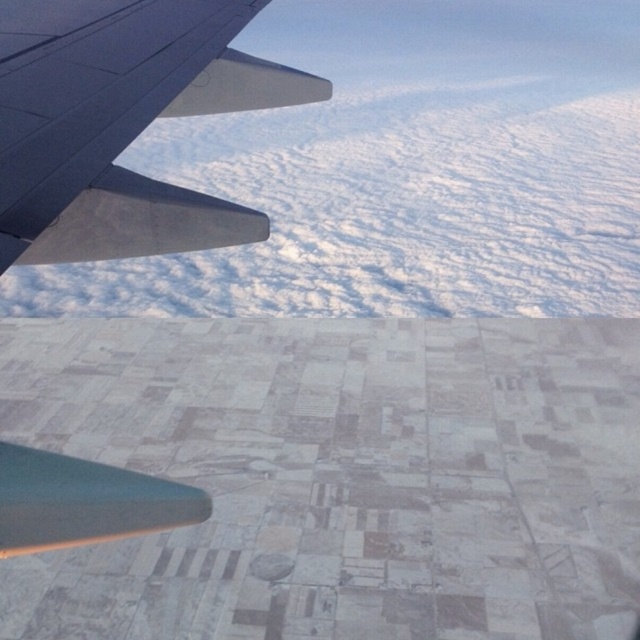
Question: Is white fluffy cloud at upper center closer to the viewer compared to metallic gray wing at upper left?

Choices:
 (A) yes
 (B) no

Answer: (B)

Question: Which point is closer to the camera?

Choices:
 (A) (177, 218)
 (B) (244, 273)

Answer: (A)

Question: Can you confirm if white fluffy cloud at upper center is smaller than metallic gray wing at upper left?

Choices:
 (A) yes
 (B) no

Answer: (B)

Question: Can you confirm if white fluffy cloud at upper center is positioned above metallic gray wing at upper left?

Choices:
 (A) yes
 (B) no

Answer: (A)